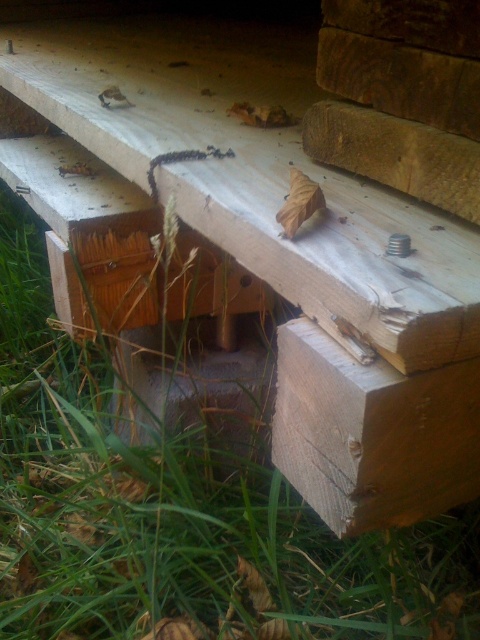
You are standing in a natural setting and notice the green grass at lower left and the natural wood plank at lower right. Which one is taller?

The green grass at lower left is taller than the natural wood plank at lower right.

You are taking a photo of the wooden structure and want to focus on both point (x=135, y=540) and point (x=334, y=244). Which point is closer to your camera lens?

Point (x=135, y=540) is closer to the camera lens than point (x=334, y=244).

You are standing in a natural setting and notice two elements in the scene. One is the green grass at lower left and the other is the natural wood at center. From your perspective, which of these two elements is positioned lower in the image?

The green grass at lower left is positioned lower than the natural wood at center.